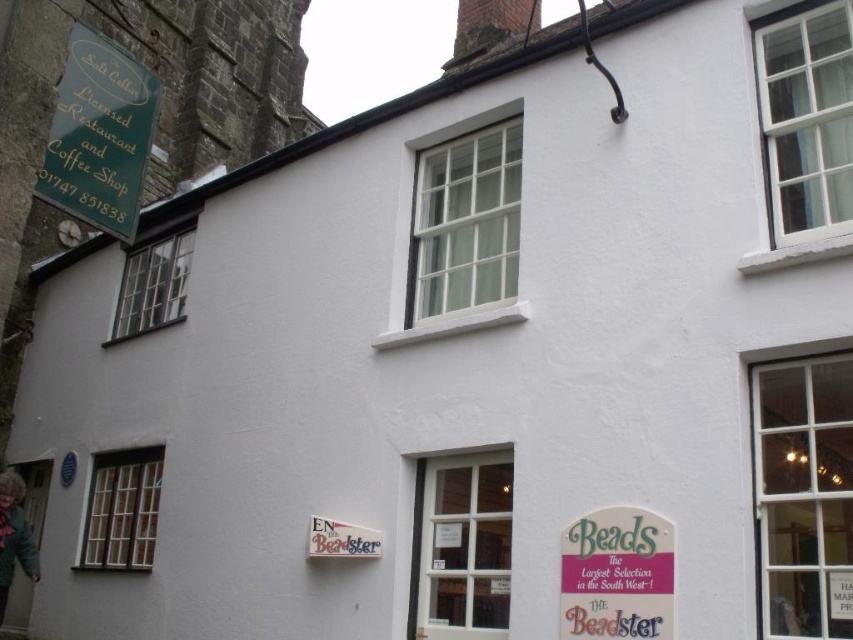
Question: Which point is closer to the camera?

Choices:
 (A) white matte sign at center
 (B) green paper sign at center

Answer: (B)

Question: In this image, where is green painted wood signboard at upper left located relative to white matte sign at center?

Choices:
 (A) below
 (B) above

Answer: (B)

Question: Is green painted wood signboard at upper left below white matte sign at center?

Choices:
 (A) no
 (B) yes

Answer: (A)

Question: Which object is positioned farthest from the white matte sign at center?

Choices:
 (A) green painted wood signboard at upper left
 (B) green paper sign at center

Answer: (A)

Question: Can you confirm if green painted wood signboard at upper left is thinner than green paper sign at center?

Choices:
 (A) no
 (B) yes

Answer: (B)

Question: Among these points, which one is farthest from the camera?

Choices:
 (A) (656, 621)
 (B) (317, 528)

Answer: (B)